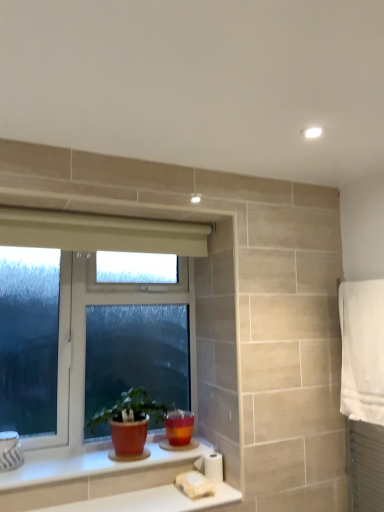
Question: Should I look upward or downward to see matte terracotta pot at lower center?

Choices:
 (A) down
 (B) up

Answer: (A)

Question: Considering the relative sizes of white glossy counter top at lower center, which is the first counter top from top to bottom, and matte terracotta pot at lower center in the image provided, is white glossy counter top at lower center, which is the first counter top from top to bottom, shorter than matte terracotta pot at lower center?

Choices:
 (A) yes
 (B) no

Answer: (A)

Question: Are white glossy counter top at lower center, arranged as the second counter top when ordered from the bottom, and matte terracotta pot at lower center far apart?

Choices:
 (A) no
 (B) yes

Answer: (A)

Question: Does white glossy counter top at lower center, arranged as the second counter top when ordered from the bottom, have a greater width compared to matte terracotta pot at lower center?

Choices:
 (A) no
 (B) yes

Answer: (A)

Question: Does white glossy counter top at lower center, which is the first counter top from top to bottom, contain matte terracotta pot at lower center?

Choices:
 (A) no
 (B) yes

Answer: (A)

Question: From a real-world perspective, is white glossy counter top at lower center, arranged as the second counter top when ordered from the bottom, over matte terracotta pot at lower center?

Choices:
 (A) no
 (B) yes

Answer: (A)

Question: Is white glossy counter top at lower center, arranged as the second counter top when ordered from the bottom, placed right next to matte terracotta pot at lower center?

Choices:
 (A) yes
 (B) no

Answer: (B)

Question: Does white glossy counter top at lower center, which is the second counter top in top-to-bottom order, have a greater width compared to matte terracotta pot at lower center?

Choices:
 (A) no
 (B) yes

Answer: (A)

Question: Is the depth of white glossy counter top at lower center, acting as the 1th counter top starting from the bottom, greater than that of matte terracotta pot at lower center?

Choices:
 (A) yes
 (B) no

Answer: (B)

Question: Does white glossy counter top at lower center, which is the second counter top in top-to-bottom order, lie in front of matte terracotta pot at lower center?

Choices:
 (A) yes
 (B) no

Answer: (A)

Question: Does white glossy counter top at lower center, acting as the 1th counter top starting from the bottom, have a smaller size compared to matte terracotta pot at lower center?

Choices:
 (A) yes
 (B) no

Answer: (A)

Question: Is white glossy counter top at lower center, which is the second counter top in top-to-bottom order, beside matte terracotta pot at lower center?

Choices:
 (A) yes
 (B) no

Answer: (B)

Question: From the image's perspective, is white glossy counter top at lower center, acting as the 1th counter top starting from the bottom, located beneath matte terracotta pot at lower center?

Choices:
 (A) yes
 (B) no

Answer: (A)

Question: Is matte terracotta pot at lower center closer to camera compared to white glossy counter top at lower center, which is the second counter top in top-to-bottom order?

Choices:
 (A) no
 (B) yes

Answer: (A)